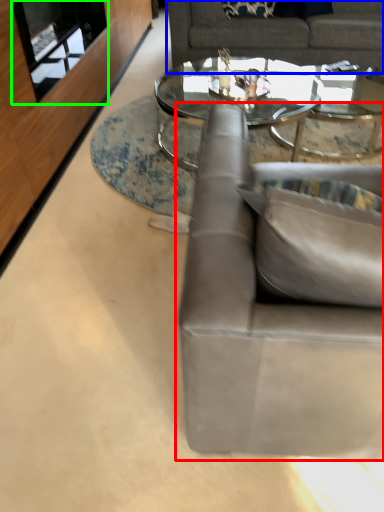
Question: Which object is the closest to the studio couch (highlighted by a red box)? Choose among these: studio couch (highlighted by a blue box) or glass door (highlighted by a green box).

Choices:
 (A) studio couch
 (B) glass door

Answer: (B)